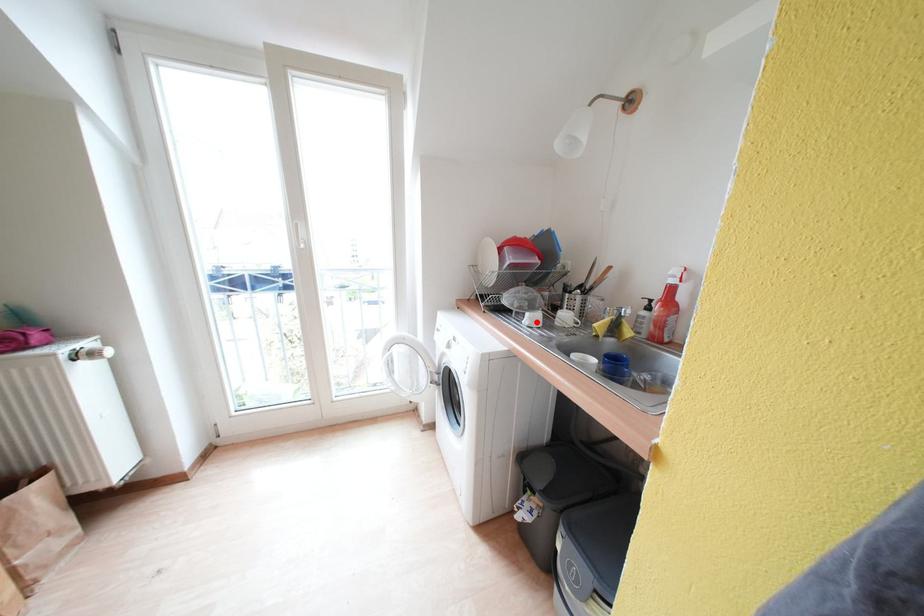
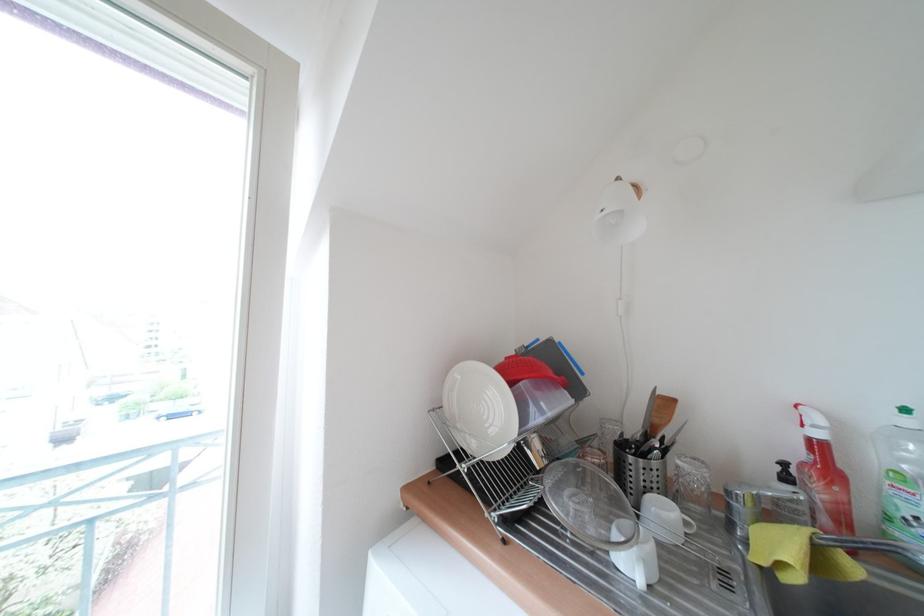
Find the pixel in the second image that matches the highlighted location in the first image.

(651, 567)